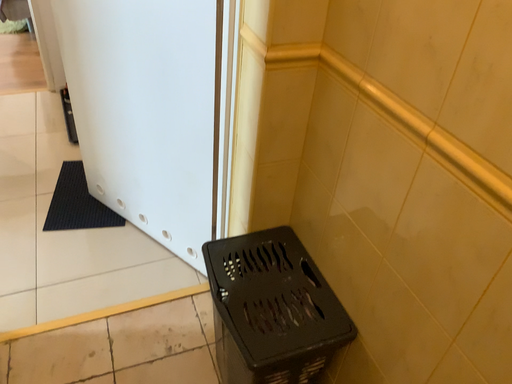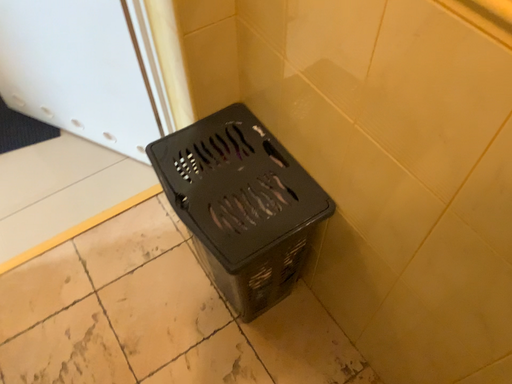
Question: Which way did the camera rotate in the video?

Choices:
 (A) rotated left
 (B) rotated right

Answer: (B)